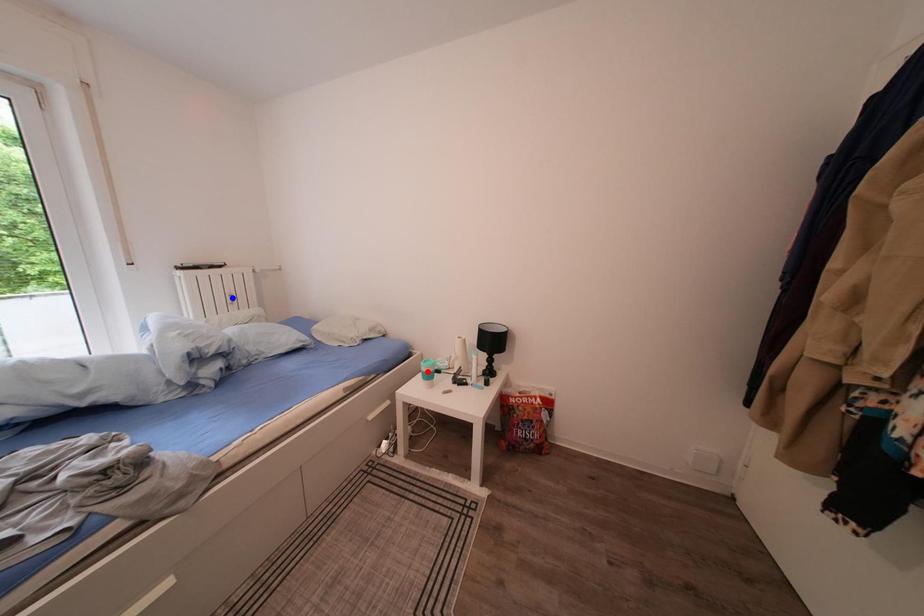
Question: Two points are marked on the image. Which point is closer to the camera?

Choices:
 (A) Blue point is closer.
 (B) Red point is closer.

Answer: (B)